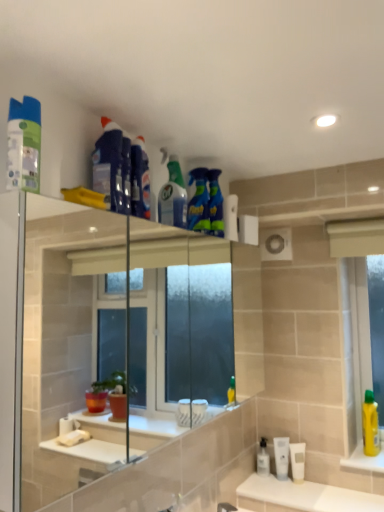
Question: Can you confirm if blue glossy spray bottle at upper center, positioned as the sixth cleaning product in front-to-back order, is wider than white matte tube at lower right, marked as the 2th mouthwash in a left-to-right arrangement?

Choices:
 (A) no
 (B) yes

Answer: (B)

Question: From a real-world perspective, is blue glossy spray bottle at upper center, marked as the 1th cleaning product in a right-to-left arrangement, positioned under white matte tube at lower right, which is counted as the second mouthwash, starting from the right, based on gravity?

Choices:
 (A) no
 (B) yes

Answer: (A)

Question: Is blue glossy spray bottle at upper center, which ranks as the 1th cleaning product in back-to-front order, in front of white matte tube at lower right, marked as the 2th mouthwash in a left-to-right arrangement?

Choices:
 (A) yes
 (B) no

Answer: (A)

Question: Does blue glossy spray bottle at upper center, positioned as the sixth cleaning product in front-to-back order, have a larger size compared to white matte tube at lower right, marked as the 2th mouthwash in a left-to-right arrangement?

Choices:
 (A) no
 (B) yes

Answer: (B)

Question: Is blue glossy spray bottle at upper center, positioned as the sixth cleaning product in front-to-back order, oriented towards white matte tube at lower right, marked as the 2th mouthwash in a left-to-right arrangement?

Choices:
 (A) yes
 (B) no

Answer: (B)

Question: In terms of width, does transparent plastic mouthwash at lower center, placed as the first mouthwash when sorted from left to right, look wider or thinner when compared to translucent green spray bottle at upper center, the 3th cleaning product viewed from the right?

Choices:
 (A) wide
 (B) thin

Answer: (B)

Question: Based on their sizes in the image, would you say transparent plastic mouthwash at lower center, which is the third mouthwash from right to left, is bigger or smaller than translucent green spray bottle at upper center, the 3th cleaning product viewed from the right?

Choices:
 (A) big
 (B) small

Answer: (B)

Question: Is transparent plastic mouthwash at lower center, which is the third mouthwash from right to left, inside the boundaries of translucent green spray bottle at upper center, which is counted as the fourth cleaning product, starting from the left, or outside?

Choices:
 (A) outside
 (B) inside

Answer: (A)

Question: From the image's perspective, is transparent plastic mouthwash at lower center, placed as the first mouthwash when sorted from left to right, located above or below translucent green spray bottle at upper center, the fourth cleaning product in the front-to-back sequence?

Choices:
 (A) below
 (B) above

Answer: (A)

Question: Considering the positions of blue glossy spray bottle at upper center, which ranks as the fourth cleaning product in back-to-front order, and white matte tube at lower center, arranged as the first mouthwash when viewed from the right, in the image, is blue glossy spray bottle at upper center, which ranks as the fourth cleaning product in back-to-front order, taller or shorter than white matte tube at lower center, arranged as the first mouthwash when viewed from the right,?

Choices:
 (A) short
 (B) tall

Answer: (B)

Question: Is blue glossy spray bottle at upper center, which ranks as the fourth cleaning product in back-to-front order, inside or outside of white matte tube at lower center, arranged as the first mouthwash when viewed from the right?

Choices:
 (A) outside
 (B) inside

Answer: (A)

Question: Considering the positions of blue glossy spray bottle at upper center, which ranks as the fourth cleaning product in back-to-front order, and white matte tube at lower center, the 3th mouthwash in the left-to-right sequence, in the image, is blue glossy spray bottle at upper center, which ranks as the fourth cleaning product in back-to-front order, wider or thinner than white matte tube at lower center, the 3th mouthwash in the left-to-right sequence,?

Choices:
 (A) wide
 (B) thin

Answer: (B)

Question: From the image's perspective, relative to white matte tube at lower center, the 3th mouthwash in the left-to-right sequence, is blue glossy spray bottle at upper center, positioned as the third cleaning product in left-to-right order, above or below?

Choices:
 (A) below
 (B) above

Answer: (B)

Question: From a real-world perspective, relative to white glossy sink at lower center, is clear plastic faucet at lower center vertically above or below?

Choices:
 (A) above
 (B) below

Answer: (A)

Question: Is clear plastic faucet at lower center inside or outside of white glossy sink at lower center?

Choices:
 (A) outside
 (B) inside

Answer: (A)